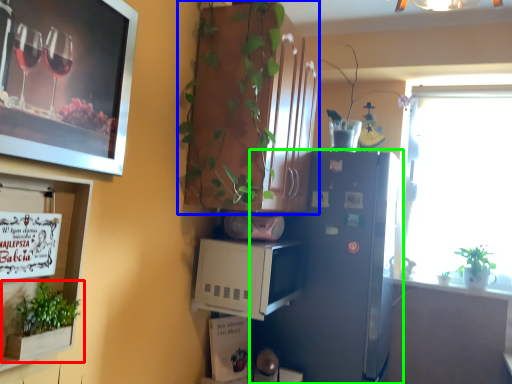
Question: Which is farther away from houseplant (highlighted by a red box)? cabinetry (highlighted by a blue box) or refrigerator (highlighted by a green box)?

Choices:
 (A) cabinetry
 (B) refrigerator

Answer: (B)